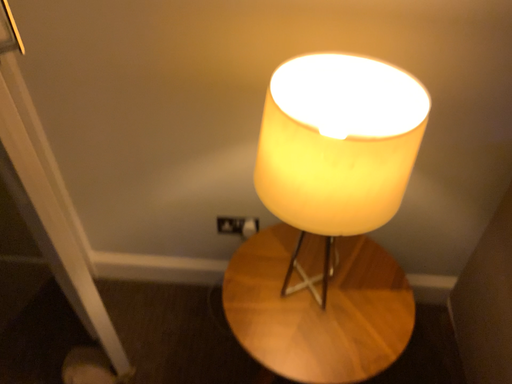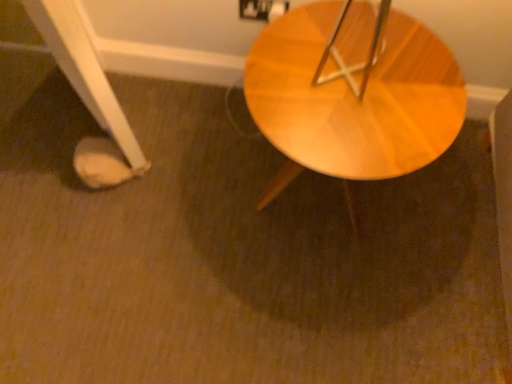
Question: How did the camera likely rotate when shooting the video?

Choices:
 (A) rotated downward
 (B) rotated upward

Answer: (A)